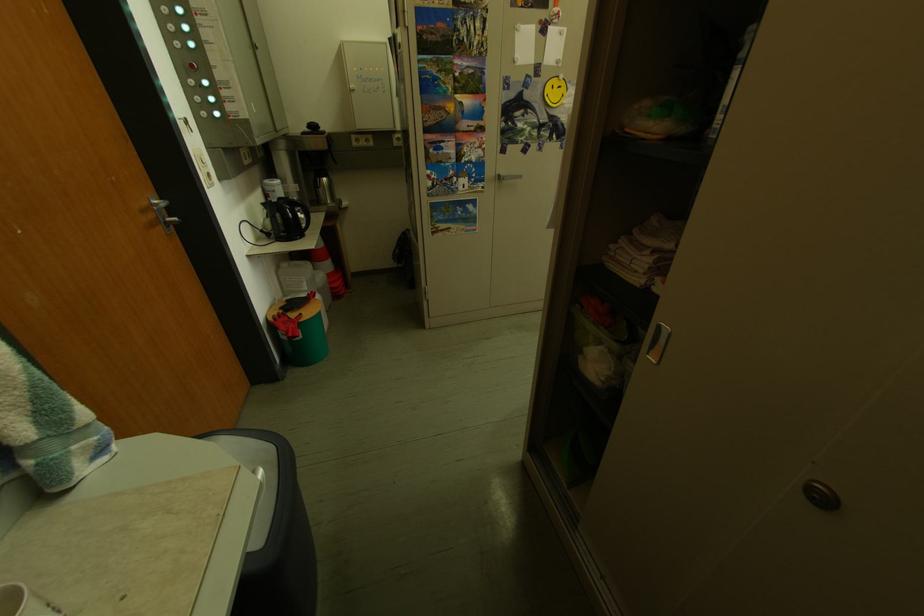
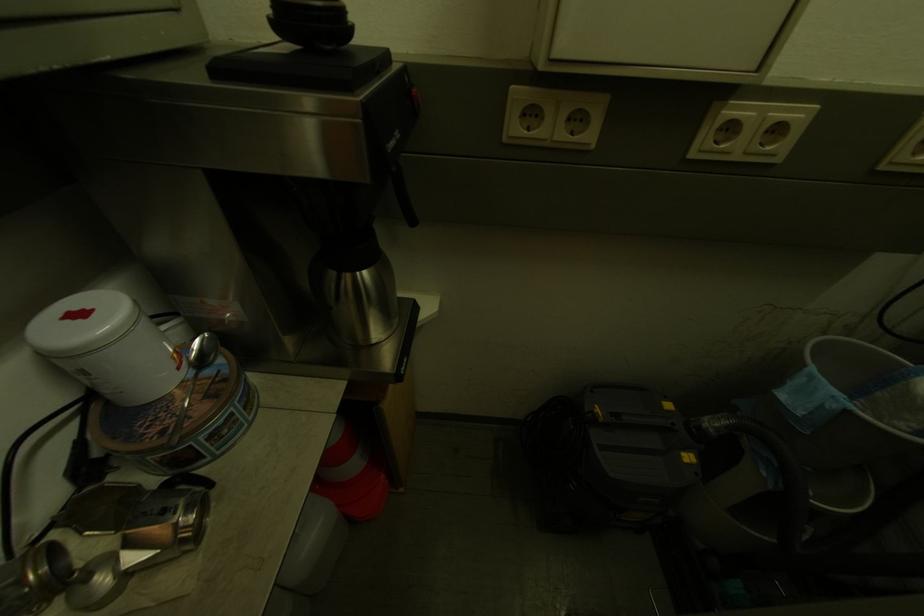
What movement of the cameraman would produce the second image?

The movement direction of the cameraman is left, forward.